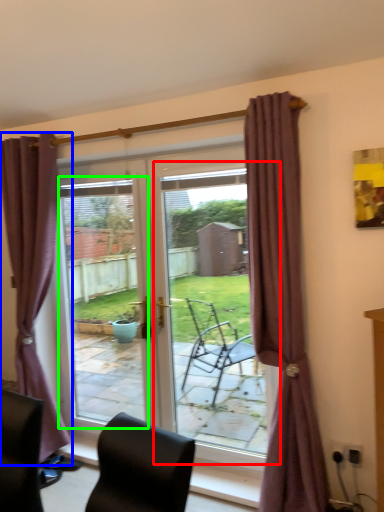
Question: Based on their relative distances, which object is nearer to screen door (highlighted by a red box)? Choose from curtain (highlighted by a blue box) and window screen (highlighted by a green box).

Choices:
 (A) curtain
 (B) window screen

Answer: (B)